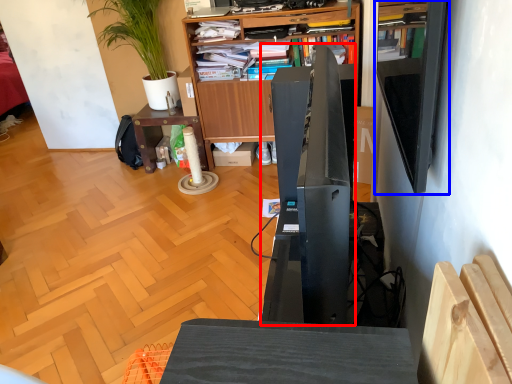
Question: Among these objects, which one is farthest to the camera, appliance (highlighted by a red box) or shelf (highlighted by a blue box)?

Choices:
 (A) appliance
 (B) shelf

Answer: (B)